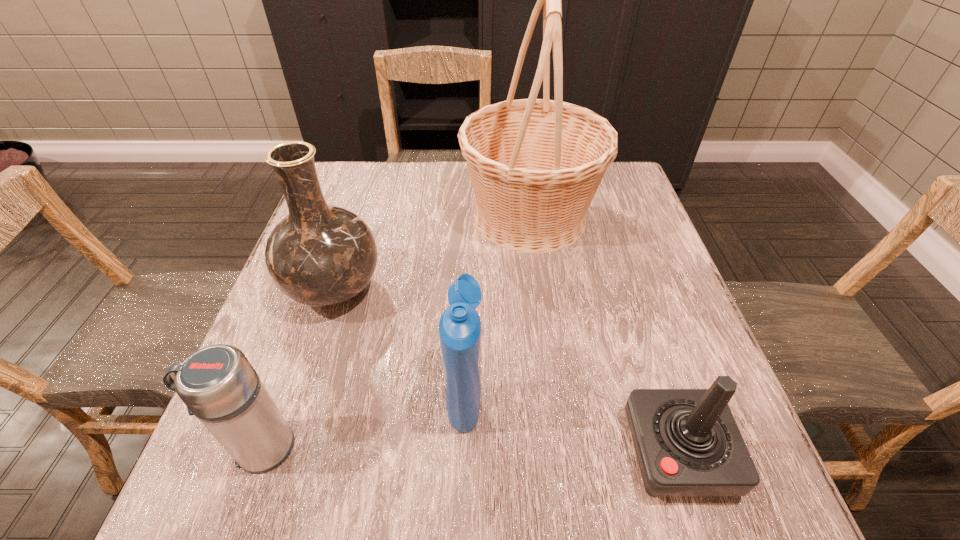
The height and width of the screenshot is (540, 960). Identify the location of vacant space situated on the front-facing side of the joystick. (414, 452).

The image size is (960, 540). Identify the location of object at the far edge. (535, 164).

Find the location of a particular element. The width and height of the screenshot is (960, 540). thermos bottle present at the near edge is located at coordinates (217, 383).

The width and height of the screenshot is (960, 540). Identify the location of joystick situated at the near edge. (687, 442).

Where is `vase that is at the left edge`? vase that is at the left edge is located at coordinates (320, 255).

Identify the location of thermos bottle at the left edge. (217, 383).

The width and height of the screenshot is (960, 540). What are the coordinates of `basket located in the right edge section of the desktop` in the screenshot? It's located at (535, 164).

You are a GUI agent. You are given a task and a screenshot of the screen. Output one action in this format:
    pyautogui.click(x=<x>, y=<y>)
    Task: Click on the joystick present at the right edge
    This screenshot has height=540, width=960.
    Given the screenshot: What is the action you would take?
    pyautogui.click(x=687, y=442)

Locate an element on the screen. The width and height of the screenshot is (960, 540). object located in the near left corner section of the desktop is located at coordinates (217, 383).

You are a GUI agent. You are given a task and a screenshot of the screen. Output one action in this format:
    pyautogui.click(x=<x>, y=<y>)
    Task: Click on the object present at the far right corner
    
    Given the screenshot: What is the action you would take?
    pyautogui.click(x=535, y=164)